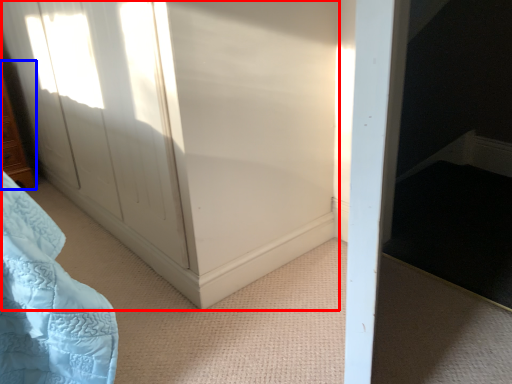
Question: Which object appears closest to the camera in this image, screen door (highlighted by a red box) or furniture (highlighted by a blue box)?

Choices:
 (A) screen door
 (B) furniture

Answer: (A)